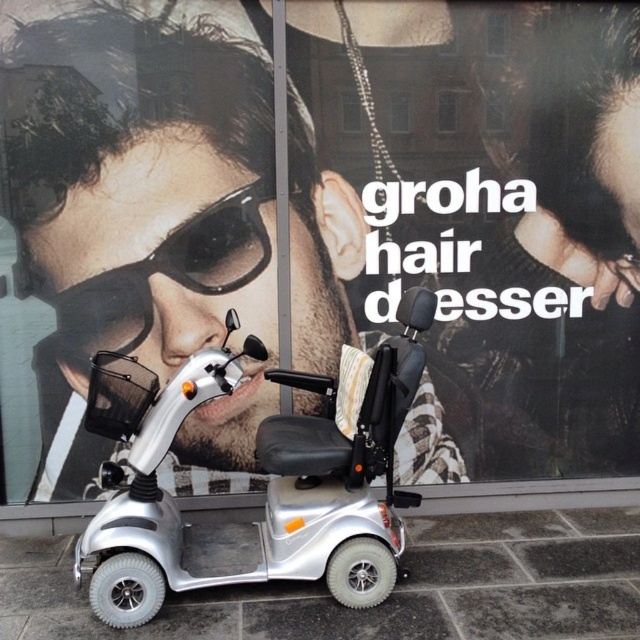
You are a delivery person who needs to park your 1.2 meters wide cart next to the silver metallic mobility scooter at center and the matte black goggles at center in the storefront window scene. Can your cart fit alongside the narrower of the two objects without overlapping them?

The silver metallic mobility scooter at center is wider than the matte black goggles at center. Since your cart is 1.2 meters wide, it can only fit alongside the narrower object, which is the matte black goggles at center, provided there is enough space. However, the description only states the scooter is wider, but doesn not specify exact measurements for the goggles. Without knowing the goggles width, it is uncertain if the cart will fit.

You are a delivery person who needs to place a package on the silver metallic mobility scooter at center without disturbing the matte black goggles at center. Where should you place the package?

The silver metallic mobility scooter at center is on the right side of the matte black goggles at center, so placing the package on the left side of the matte black goggles at center would keep it away from the scooter.

You are a delivery person who needs to load a package onto the silver metallic mobility scooter at center. The package is 1.2 meters tall. Can the package be placed on the scooter without exceeding the height limit imposed by the matte black goggles at center?

The silver metallic mobility scooter at center is much taller than the matte black goggles at center. Since the scooter itself is taller, the package that is 1.2 meters tall can be placed on the scooter without exceeding the height limit imposed by the matte black goggles at center.